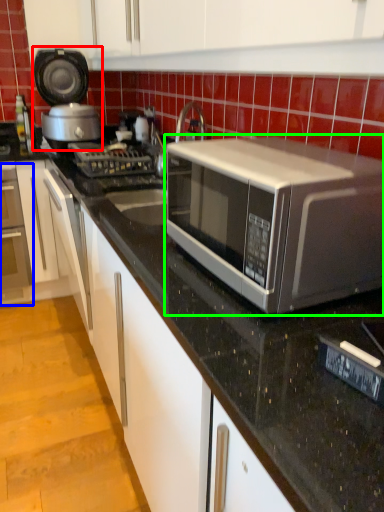
Question: Which is nearer to the appliance (highlighted by a red box)? oven (highlighted by a blue box) or microwave oven (highlighted by a green box).

Choices:
 (A) oven
 (B) microwave oven

Answer: (A)